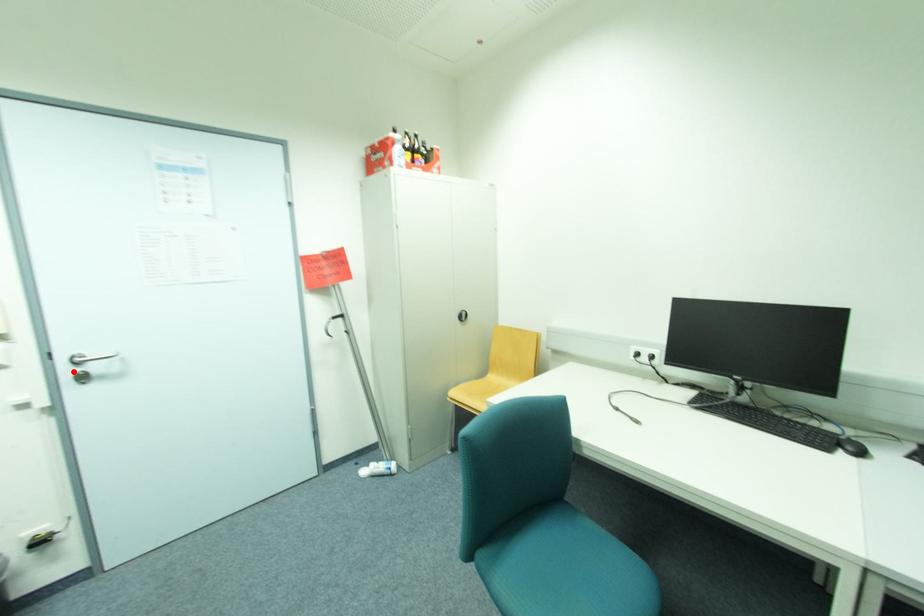
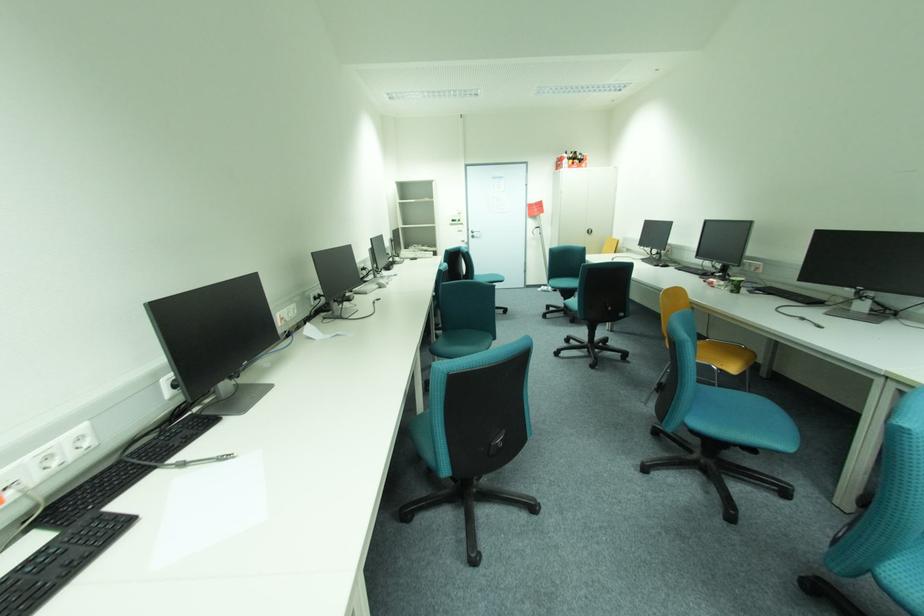
Question: I am providing you with two images of the same scene from different viewpoints. Image1 has a red point marked. In image2, the corresponding 3D location appears at what relative position? Reply with the corresponding letter.

Choices:
 (A) Closer
 (B) Farther

Answer: (A)